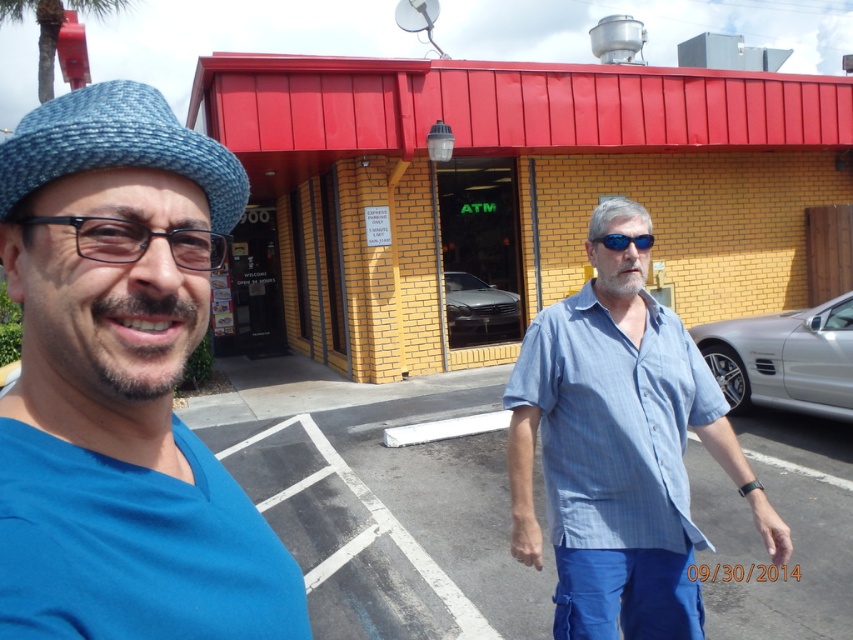
Which is more to the right, black plastic glasses at left or blue reflective sunglasses at center?

From the viewer's perspective, blue reflective sunglasses at center appears more on the right side.

From the picture: Can you confirm if black plastic glasses at left is positioned above blue reflective sunglasses at center?

No.

Measure the distance between black plastic glasses at left and camera.

black plastic glasses at left is 27.96 inches away from camera.

Image resolution: width=853 pixels, height=640 pixels. I want to click on black plastic glasses at left, so click(x=138, y=241).

Who is shorter, blue cotton shirt at center or blue reflective sunglasses at center?

With less height is blue reflective sunglasses at center.

Is blue cotton shirt at center thinner than blue reflective sunglasses at center?

Incorrect, blue cotton shirt at center's width is not less than blue reflective sunglasses at center's.

Who is more distant from viewer, (x=573, y=468) or (x=643, y=246)?

The point (x=643, y=246) is more distant.

At what (x,y) coordinates should I click in order to perform the action: click on blue cotton shirt at center. Please return your answer as a coordinate pair (x, y). Looking at the image, I should click on (619, 449).

Measure the distance between blue woven hat at left and blue reflective sunglasses at center.

blue woven hat at left is 1.40 meters away from blue reflective sunglasses at center.

Is blue woven hat at left positioned before blue reflective sunglasses at center?

Yes, it is.

Describe the element at coordinates (117, 147) in the screenshot. I see `blue woven hat at left` at that location.

Identify the location of blue woven hat at left. The image size is (853, 640). (117, 147).